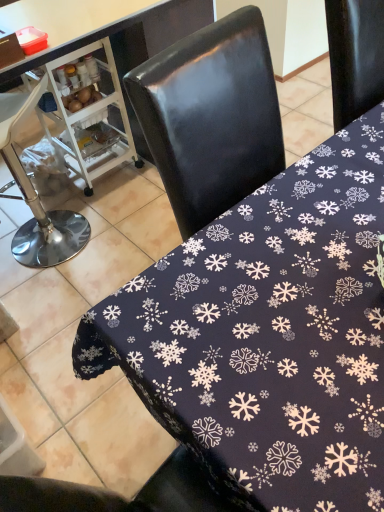
Question: Which direction should I rotate to look at dark blue fabric with snowflake pattern at center, the 1th table positioned from the right?

Choices:
 (A) right
 (B) left

Answer: (A)

Question: Does white plastic cart at left have a smaller size compared to brushed metal bar stool at left?

Choices:
 (A) yes
 (B) no

Answer: (A)

Question: Is white plastic cart at left thinner than brushed metal bar stool at left?

Choices:
 (A) no
 (B) yes

Answer: (A)

Question: Considering the relative sizes of white plastic cart at left and brushed metal bar stool at left in the image provided, is white plastic cart at left bigger than brushed metal bar stool at left?

Choices:
 (A) no
 (B) yes

Answer: (A)

Question: Is white plastic cart at left closer to camera compared to brushed metal bar stool at left?

Choices:
 (A) yes
 (B) no

Answer: (B)

Question: Is white plastic cart at left in contact with brushed metal bar stool at left?

Choices:
 (A) yes
 (B) no

Answer: (B)

Question: Does white plastic cart at left have a lesser height compared to brushed metal bar stool at left?

Choices:
 (A) no
 (B) yes

Answer: (B)

Question: From the image's perspective, would you say black fabric tablecloth at center, the first table positioned from the left, is positioned over brushed metal bar stool at left?

Choices:
 (A) yes
 (B) no

Answer: (A)

Question: Does black fabric tablecloth at center, the first table positioned from the left, have a smaller size compared to brushed metal bar stool at left?

Choices:
 (A) yes
 (B) no

Answer: (B)

Question: From the image's perspective, is black fabric tablecloth at center, the first table positioned from the left, located beneath brushed metal bar stool at left?

Choices:
 (A) yes
 (B) no

Answer: (B)

Question: Is black fabric tablecloth at center, the first table positioned from the left, bigger than brushed metal bar stool at left?

Choices:
 (A) no
 (B) yes

Answer: (B)

Question: Is brushed metal bar stool at left a part of black fabric tablecloth at center, the second table in the right-to-left sequence?

Choices:
 (A) no
 (B) yes

Answer: (B)

Question: Is black fabric tablecloth at center, the second table in the right-to-left sequence, taller than brushed metal bar stool at left?

Choices:
 (A) yes
 (B) no

Answer: (A)

Question: Does black fabric tablecloth at center, the second table in the right-to-left sequence, have a lesser width compared to dark blue fabric with snowflake pattern at center, which is the 2th table from left to right?

Choices:
 (A) no
 (B) yes

Answer: (B)